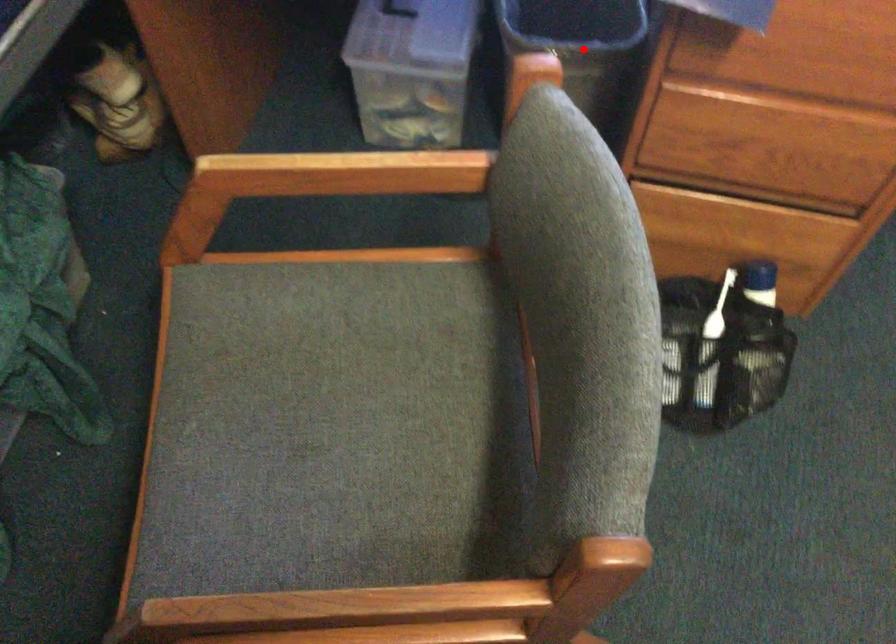
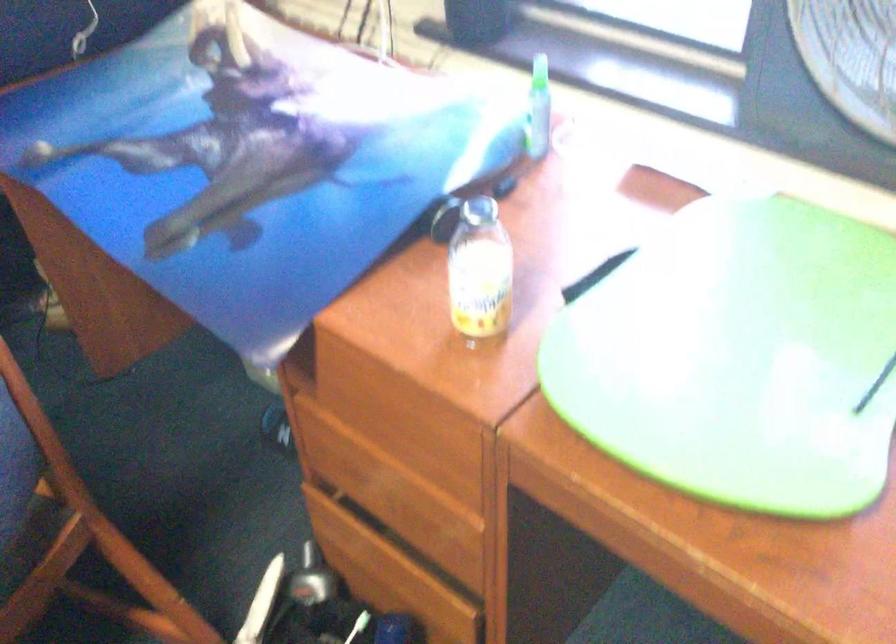
Question: I am providing you with two images of the same scene from different viewpoints. A red point is marked on the first image. Can you still see the location of the red point in image 2?

Choices:
 (A) Yes
 (B) No

Answer: (B)